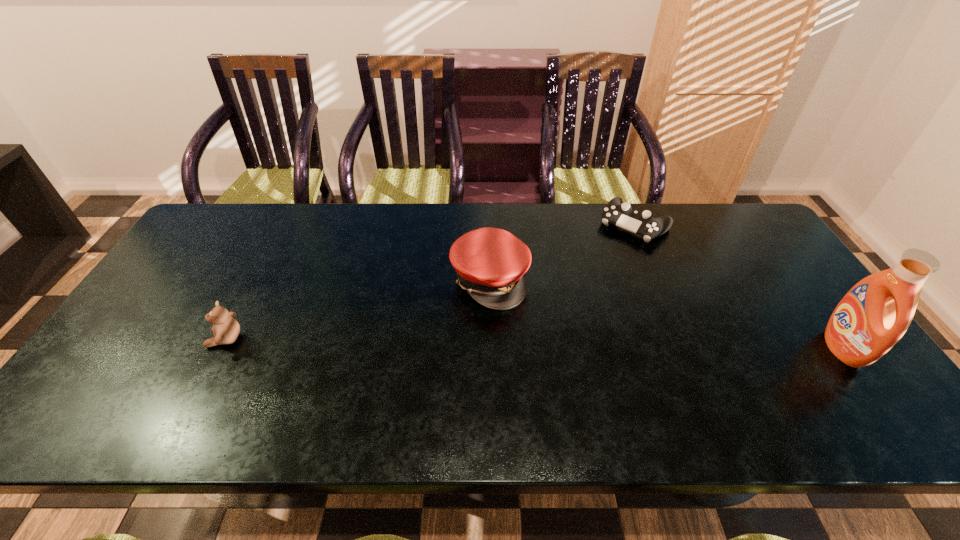
Where is `object present at the near edge`? object present at the near edge is located at coordinates (872, 317).

I want to click on object that is at the right edge, so click(x=872, y=317).

The height and width of the screenshot is (540, 960). What are the coordinates of `object present at the near right corner` in the screenshot? It's located at (872, 317).

In the image, there is a desktop. Identify the location of vacant region at the far edge. This screenshot has width=960, height=540. (636, 245).

Locate an element on the screen. The height and width of the screenshot is (540, 960). free space at the near edge of the desktop is located at coordinates (324, 389).

This screenshot has height=540, width=960. Identify the location of vacant area at the left edge. (200, 262).

The height and width of the screenshot is (540, 960). In order to click on vacant space at the far left corner of the desktop in this screenshot , I will do 206,235.

This screenshot has height=540, width=960. Identify the location of free space between the rightmost object and the third nearest object. (666, 314).

The image size is (960, 540). Identify the location of free space between the tallest object and the cap. (666, 314).

At what (x,y) coordinates should I click in order to perform the action: click on free space that is in between the farthest object and the tallest object. Please return your answer as a coordinate pair (x, y). The height and width of the screenshot is (540, 960). Looking at the image, I should click on (738, 287).